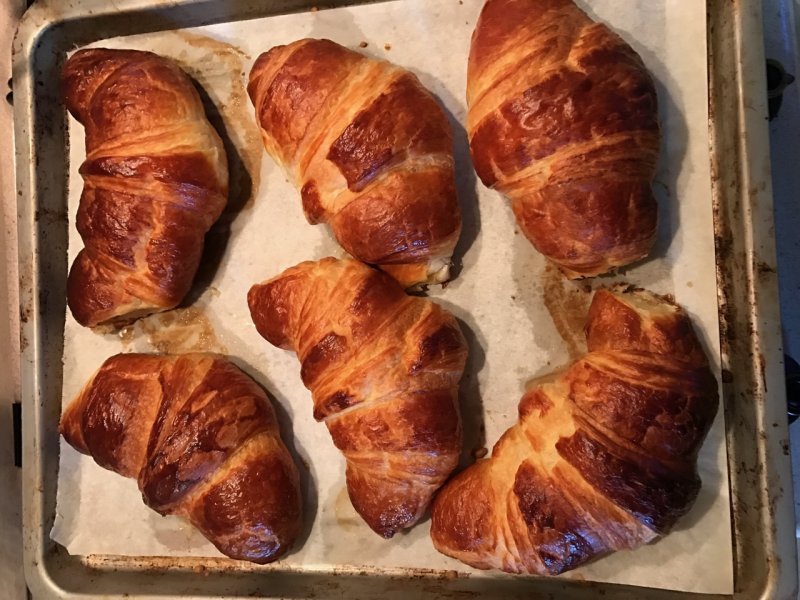
Identify the location of aluminum baking tray. The image size is (800, 600). (145, 568).